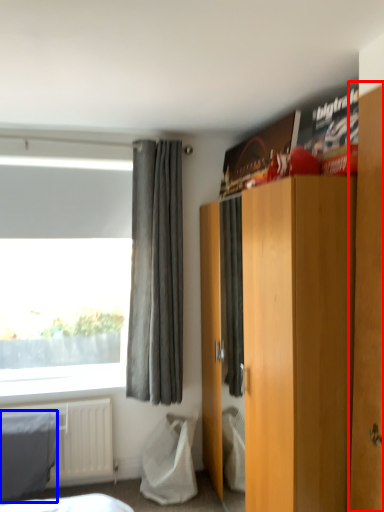
Question: Which of the following is the farthest to the observer, armoire (highlighted by a red box) or blanket (highlighted by a blue box)?

Choices:
 (A) armoire
 (B) blanket

Answer: (B)